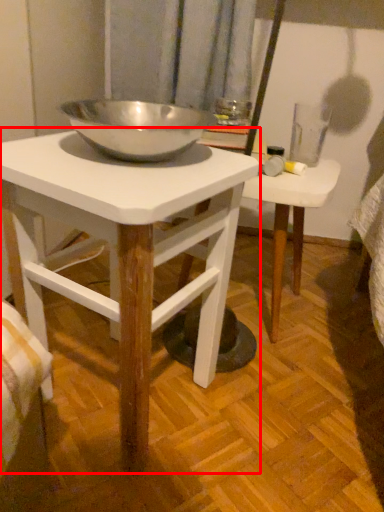
Question: Observing the image, what is the correct spatial positioning of table (annotated by the red box) in reference to table?

Choices:
 (A) left
 (B) right

Answer: (A)